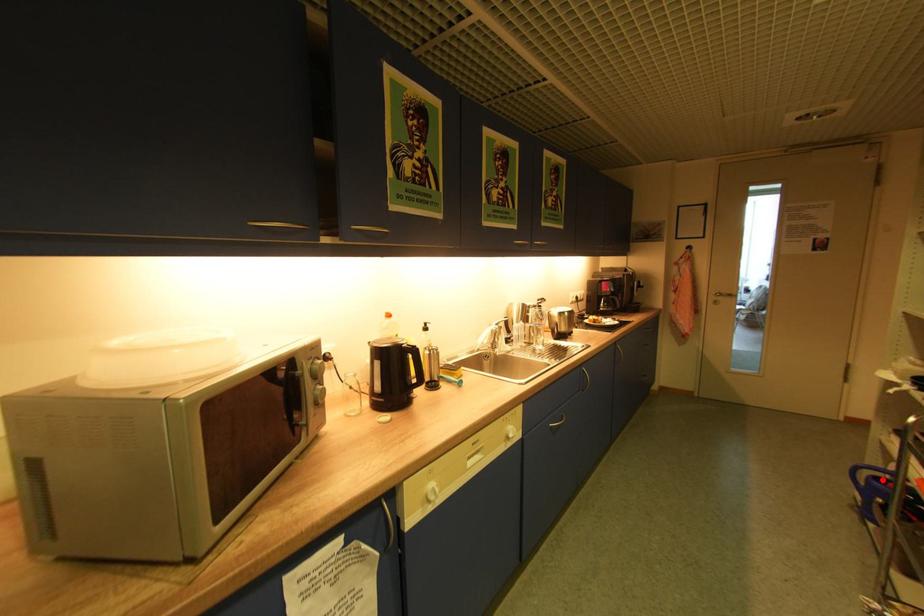
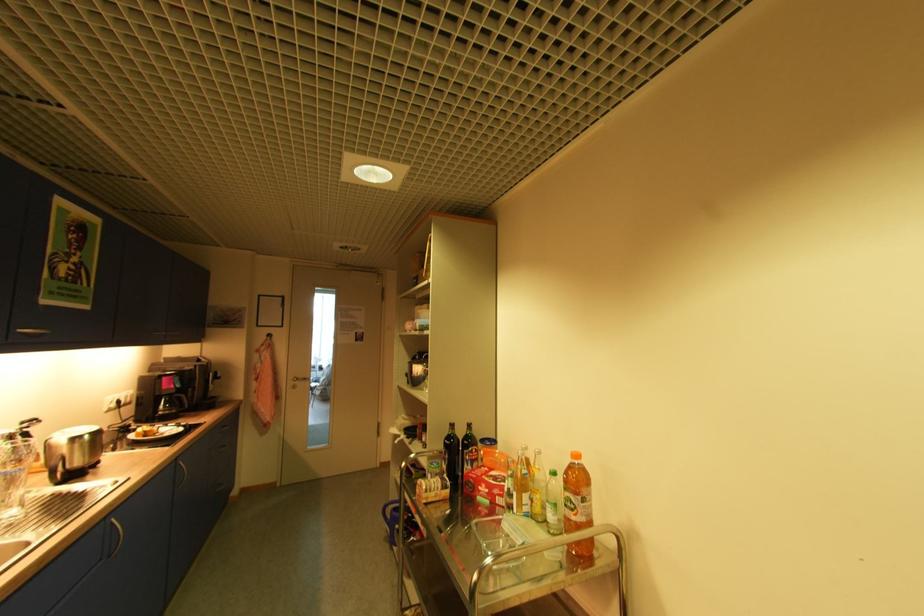
Question: I am providing you with two images of the same scene from different viewpoints. A red point is shown in image1. For the corresponding object point in image2, is it positioned nearer or farther from the camera?

Choices:
 (A) Nearer
 (B) Farther

Answer: (B)